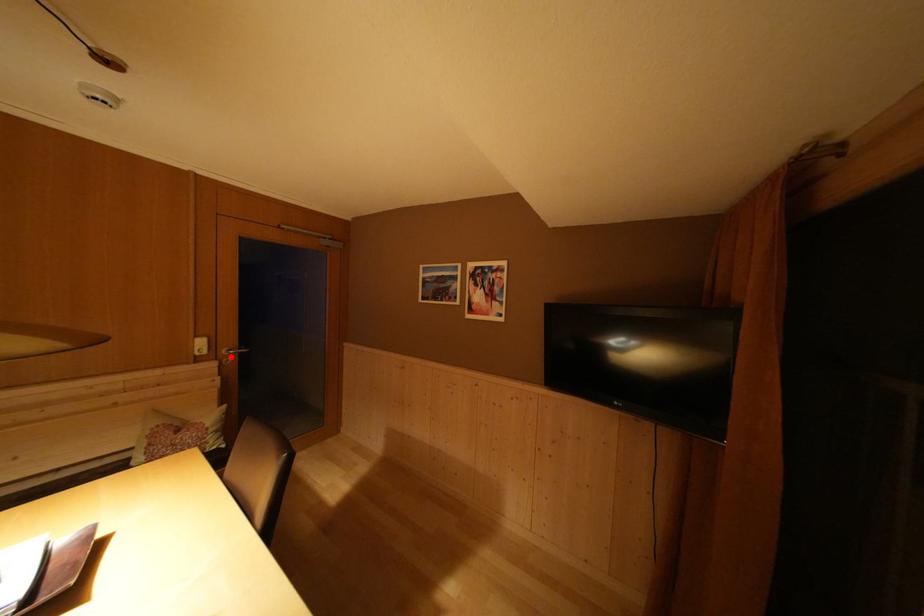
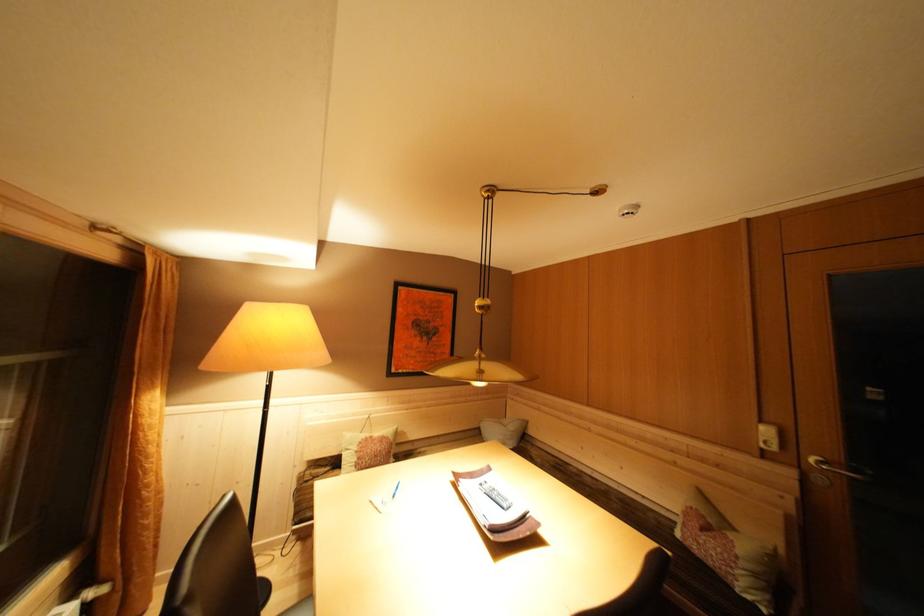
Where in the second image is the point corresponding to the highlighted location from the first image?

(819, 466)